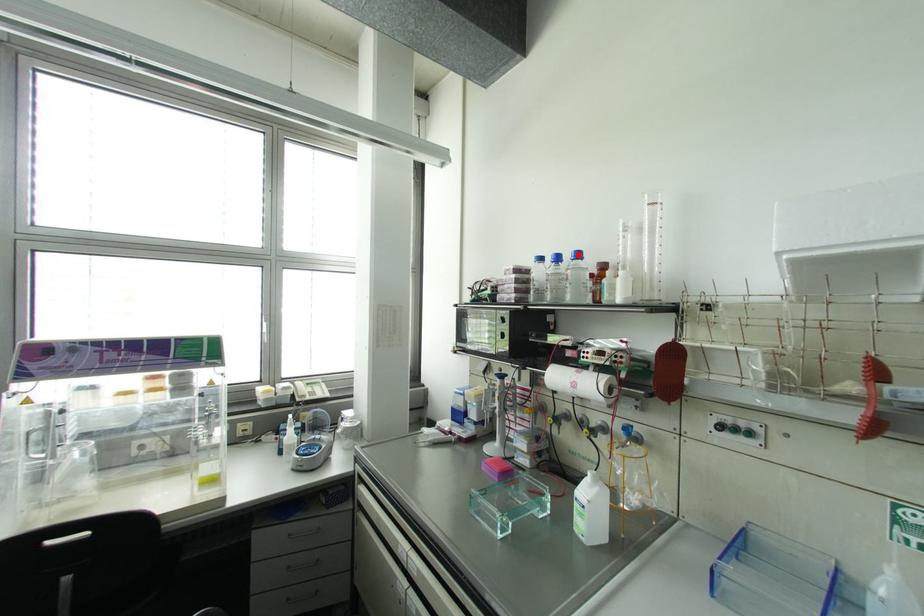
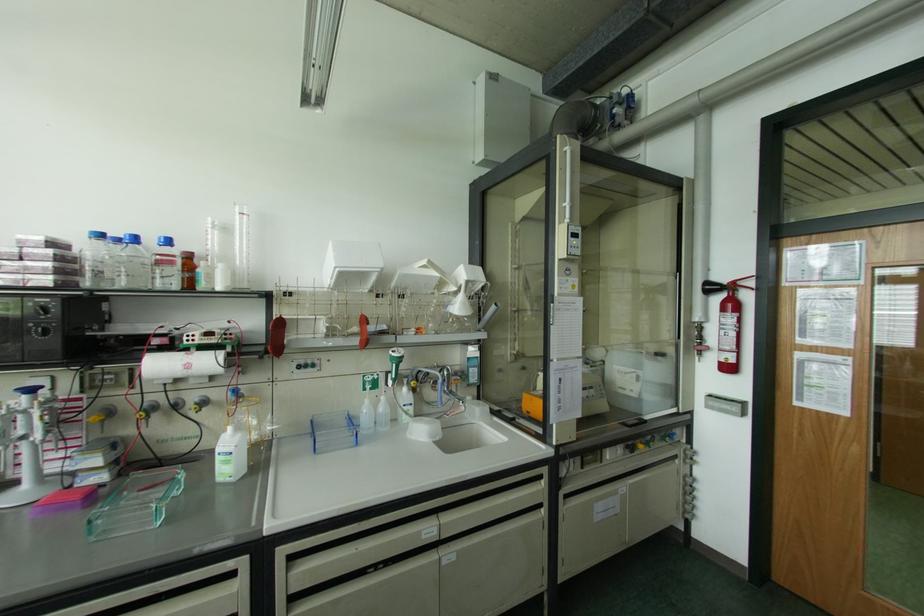
Find the pixel in the second image that matches the highlighted location in the first image.

(167, 241)